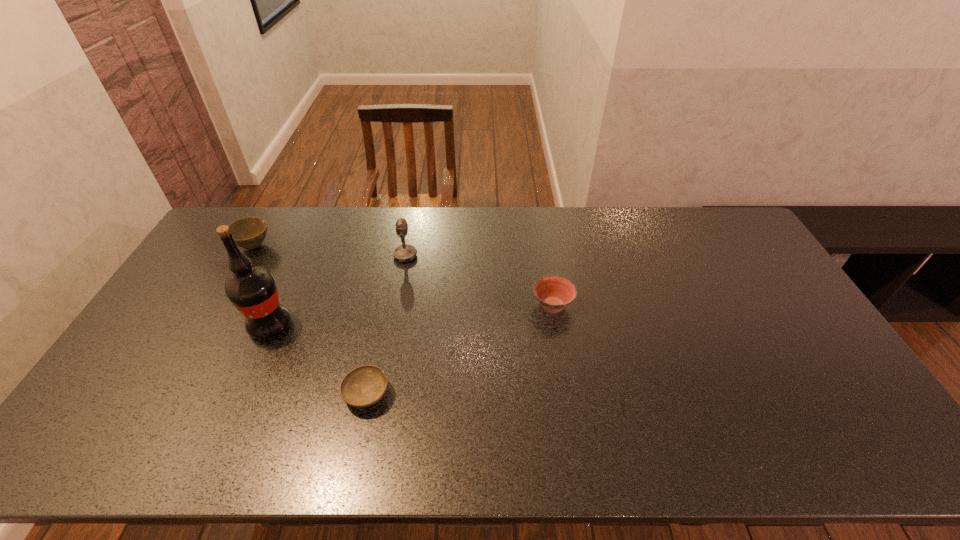
Image resolution: width=960 pixels, height=540 pixels. Identify the location of vacant space that's between the shortest object and the microphone. click(x=386, y=325).

The image size is (960, 540). In order to click on object that is the third closest one to the shortest bowl in this screenshot , I will do `click(406, 253)`.

Select which object is the third closest to the wine bottle. Please provide its 2D coordinates. Your answer should be formatted as a tuple, i.e. [(x, y)], where the tuple contains the x and y coordinates of a point satisfying the conditions above.

[(406, 253)]

Point out which bowl is positioned as the second nearest to the microphone. Please provide its 2D coordinates. Your answer should be formatted as a tuple, i.e. [(x, y)], where the tuple contains the x and y coordinates of a point satisfying the conditions above.

[(249, 233)]

Select which bowl appears as the third closest to the wine bottle. Please provide its 2D coordinates. Your answer should be formatted as a tuple, i.e. [(x, y)], where the tuple contains the x and y coordinates of a point satisfying the conditions above.

[(554, 293)]

Locate an element on the screen. free spot that satisfies the following two spatial constraints: 1. on the front-facing side of the microphone; 2. on the right side of the rightmost bowl is located at coordinates (396, 305).

At what (x,y) coordinates should I click in order to perform the action: click on vacant space that satisfies the following two spatial constraints: 1. on the back side of the wine bottle; 2. on the left side of the second tallest bowl. Please return your answer as a coordinate pair (x, y). The width and height of the screenshot is (960, 540). Looking at the image, I should click on (278, 305).

You are a GUI agent. You are given a task and a screenshot of the screen. Output one action in this format:
    pyautogui.click(x=<x>, y=<y>)
    Task: Click on the free space that satisfies the following two spatial constraints: 1. on the front-facing side of the second tallest bowl; 2. on the right side of the fourth shortest object
    The width and height of the screenshot is (960, 540).
    Given the screenshot: What is the action you would take?
    pyautogui.click(x=396, y=305)

Where is `vacant space that satisfies the following two spatial constraints: 1. on the front-facing side of the microphone; 2. on the front side of the tallest object`? Image resolution: width=960 pixels, height=540 pixels. vacant space that satisfies the following two spatial constraints: 1. on the front-facing side of the microphone; 2. on the front side of the tallest object is located at coordinates (393, 325).

Locate an element on the screen. This screenshot has width=960, height=540. free point that satisfies the following two spatial constraints: 1. on the front-facing side of the second shortest object; 2. on the right side of the fourth shortest object is located at coordinates (396, 305).